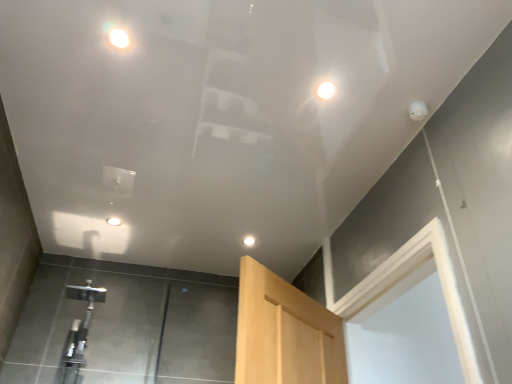
Question: Does matte white droplight at upper center, the 4th droplight positioned from the back, appear on the left side of satin nickel faucet at lower left?

Choices:
 (A) yes
 (B) no

Answer: (B)

Question: Does matte white droplight at upper center, acting as the second droplight starting from the left, have a smaller size compared to satin nickel faucet at lower left?

Choices:
 (A) yes
 (B) no

Answer: (A)

Question: Is the depth of matte white droplight at upper center, arranged as the 3th droplight when viewed from the right, less than that of satin nickel faucet at lower left?

Choices:
 (A) yes
 (B) no

Answer: (A)

Question: Is matte white droplight at upper center, arranged as the first droplight when viewed from the front, shorter than satin nickel faucet at lower left?

Choices:
 (A) no
 (B) yes

Answer: (B)

Question: Is matte white droplight at upper center, arranged as the 3th droplight when viewed from the right, placed right next to satin nickel faucet at lower left?

Choices:
 (A) yes
 (B) no

Answer: (B)

Question: Does matte white droplight at upper center, arranged as the first droplight when viewed from the front, come behind satin nickel faucet at lower left?

Choices:
 (A) yes
 (B) no

Answer: (B)

Question: From the image's perspective, is white glossy droplight at upper center, which ranks as the 1th droplight in bottom-to-top order, below white glossy droplight at upper center, the 1th droplight when ordered from left to right?

Choices:
 (A) yes
 (B) no

Answer: (A)

Question: Is white glossy droplight at upper center, which is the 4th droplight in front-to-back order, outside white glossy droplight at upper center, the 1th droplight when ordered from left to right?

Choices:
 (A) yes
 (B) no

Answer: (A)

Question: Can you confirm if white glossy droplight at upper center, arranged as the 1th droplight when viewed from the back, is wider than white glossy droplight at upper center, which ranks as the third droplight in top-to-bottom order?

Choices:
 (A) no
 (B) yes

Answer: (A)

Question: Is white glossy droplight at upper center, which is counted as the second droplight, starting from the right, shorter than white glossy droplight at upper center, which is the third droplight from front to back?

Choices:
 (A) yes
 (B) no

Answer: (B)

Question: Can you confirm if white glossy droplight at upper center, which is the third droplight from left to right, is taller than white glossy droplight at upper center, which ranks as the third droplight in top-to-bottom order?

Choices:
 (A) yes
 (B) no

Answer: (A)

Question: Is white glossy droplight at upper center, which is counted as the second droplight, starting from the right, with white glossy droplight at upper center, which ranks as the 2th droplight in bottom-to-top order?

Choices:
 (A) no
 (B) yes

Answer: (A)

Question: Could you tell me if matte white droplight at upper center, the 1th droplight in the top-to-bottom sequence, is turned towards white glossy droplight at upper center, the 1th droplight when ordered from left to right?

Choices:
 (A) no
 (B) yes

Answer: (A)